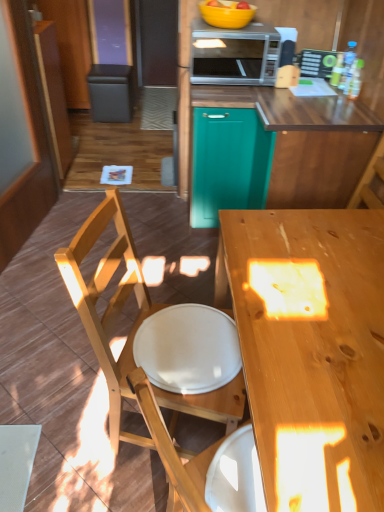
Locate an element on the screen. This screenshot has width=384, height=512. free spot to the left of wooden chair at left is located at coordinates (59, 415).